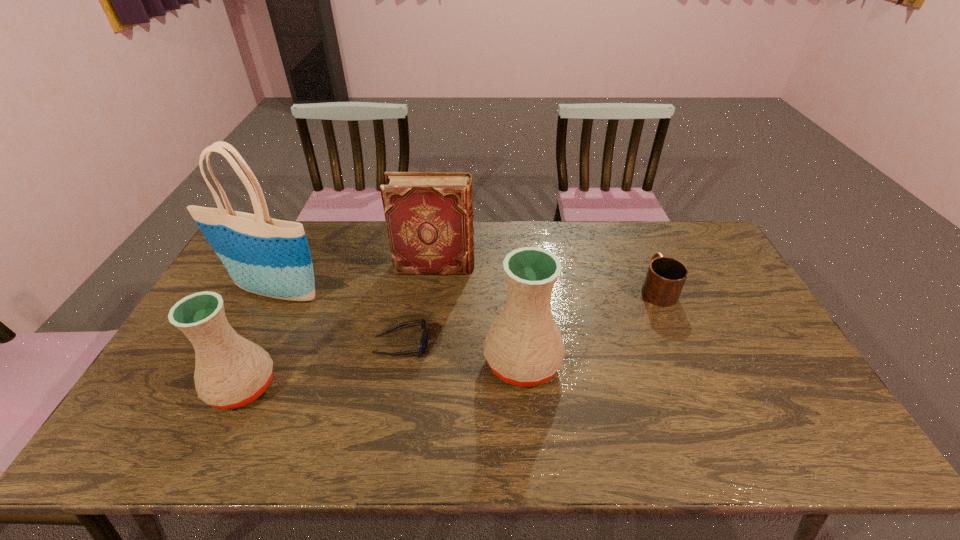
Where is `object positioned at the near left corner`? object positioned at the near left corner is located at coordinates (230, 372).

In the image, there is a desktop. Where is `vacant region at the far edge`? The width and height of the screenshot is (960, 540). vacant region at the far edge is located at coordinates (650, 242).

Locate an element on the screen. free spot at the near edge of the desktop is located at coordinates (372, 402).

Find the location of a particular element. The height and width of the screenshot is (540, 960). vacant space at the right edge is located at coordinates (760, 323).

The image size is (960, 540). Identify the location of vacant area at the far right corner of the desktop. (669, 228).

Where is `free space between the taller pottery and the shortest object`? The width and height of the screenshot is (960, 540). free space between the taller pottery and the shortest object is located at coordinates (462, 353).

Image resolution: width=960 pixels, height=540 pixels. In order to click on free spot between the right pottery and the shortest object in this screenshot , I will do pyautogui.click(x=462, y=353).

Find the location of a particular element. The height and width of the screenshot is (540, 960). blank region between the fifth tallest object and the tote bag is located at coordinates (466, 290).

Identify the location of free area in between the sunglasses and the third shortest object. (322, 366).

Where is `vacant point located between the shortest object and the right pottery`? The image size is (960, 540). vacant point located between the shortest object and the right pottery is located at coordinates (462, 353).